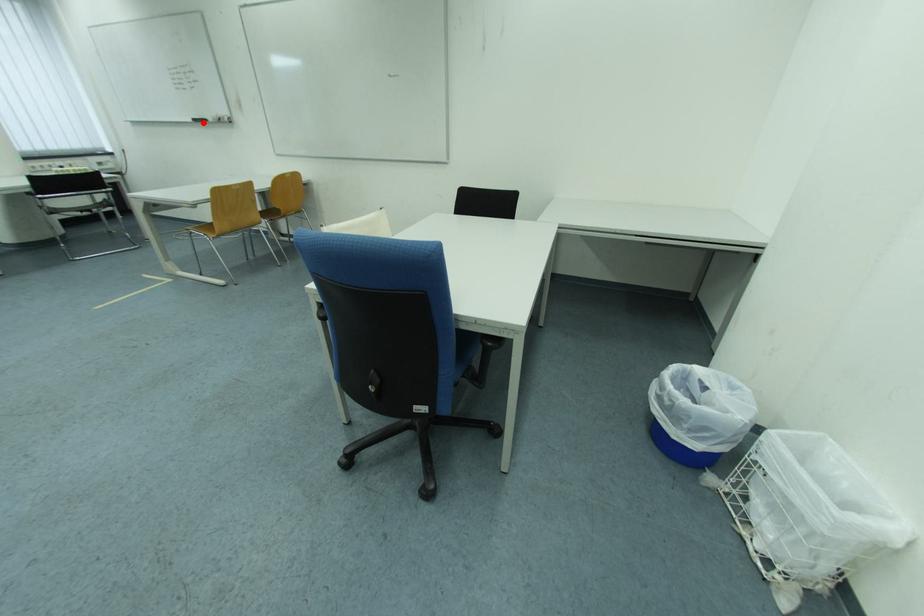
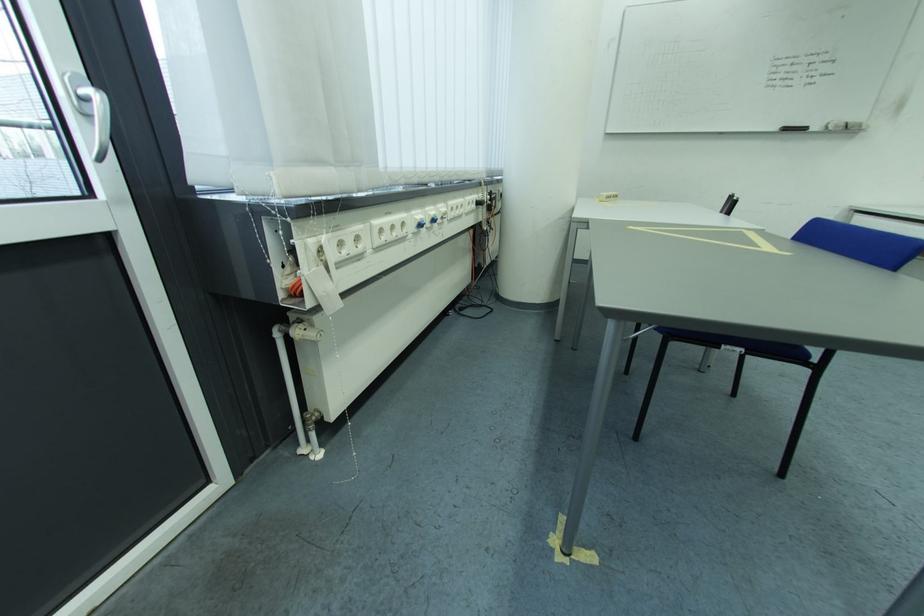
The point at the highlighted location is marked in the first image. Where is the corresponding point in the second image?

(796, 131)